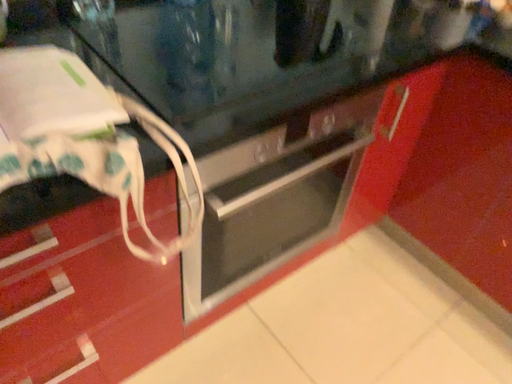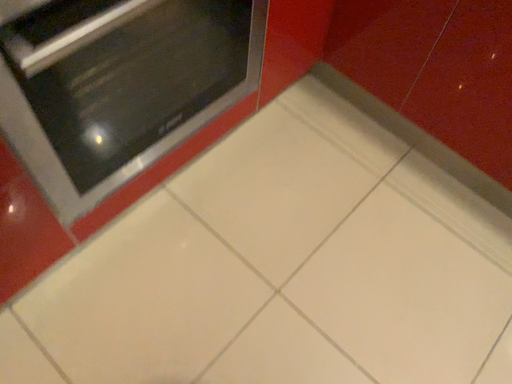
Question: How did the camera likely rotate when shooting the video?

Choices:
 (A) rotated upward
 (B) rotated downward

Answer: (B)